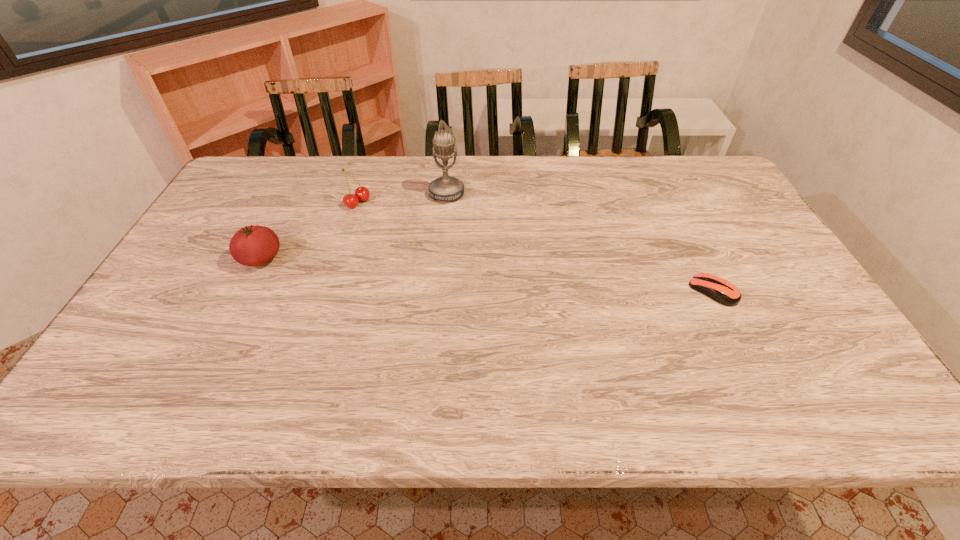
The image size is (960, 540). I want to click on vacant space located on the front-facing side of the second object from right to left, so click(x=407, y=284).

Where is `free location located on the front-facing side of the second object from right to left`? This screenshot has width=960, height=540. free location located on the front-facing side of the second object from right to left is located at coordinates (435, 222).

At what (x,y) coordinates should I click in order to perform the action: click on vacant space positioned 0.360m with the stems of the cherry pointing upwards. Please return your answer as a coordinate pair (x, y). Looking at the image, I should click on (455, 256).

You are a GUI agent. You are given a task and a screenshot of the screen. Output one action in this format:
    pyautogui.click(x=<x>, y=<y>)
    Task: Click on the free space located 0.360m with the stems of the cherry pointing upwards
    The image size is (960, 540).
    Given the screenshot: What is the action you would take?
    pyautogui.click(x=455, y=256)

You are a GUI agent. You are given a task and a screenshot of the screen. Output one action in this format:
    pyautogui.click(x=<x>, y=<y>)
    Task: Click on the free space located with the stems of the cherry pointing upwards
    This screenshot has width=960, height=540.
    Given the screenshot: What is the action you would take?
    pyautogui.click(x=447, y=252)

At what (x,y) coordinates should I click in order to perform the action: click on microphone positioned at the far edge. Please return your answer as a coordinate pair (x, y). Looking at the image, I should click on (445, 188).

Where is `cherry at the far edge`? The height and width of the screenshot is (540, 960). cherry at the far edge is located at coordinates (361, 193).

Where is `object located in the left edge section of the desktop`? Image resolution: width=960 pixels, height=540 pixels. object located in the left edge section of the desktop is located at coordinates pos(254,245).

This screenshot has width=960, height=540. In order to click on free point at the far edge in this screenshot , I will do `click(618, 174)`.

The height and width of the screenshot is (540, 960). Identify the location of free region at the near edge of the desktop. (290, 346).